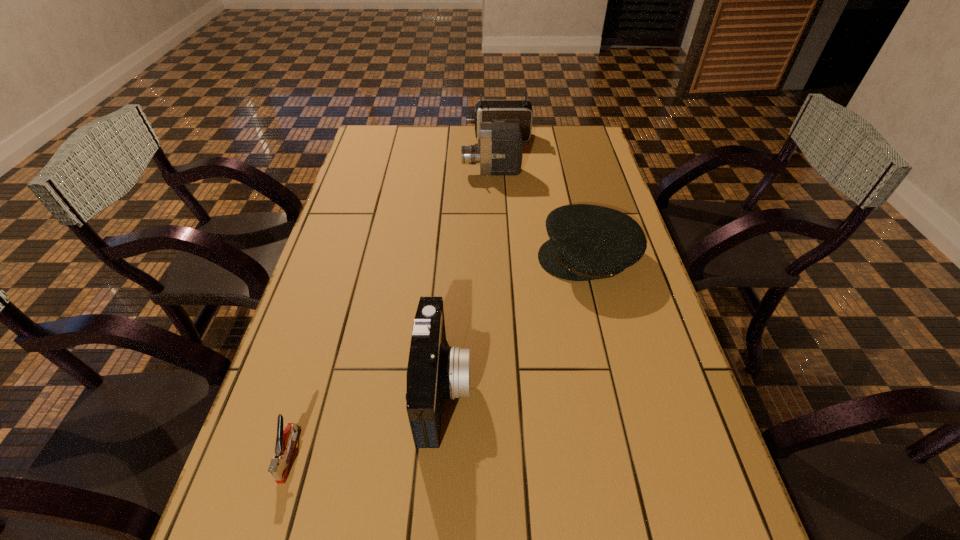
The width and height of the screenshot is (960, 540). In order to click on free space located 0.330m at the front of the second farthest camcorder, highlighting the lens in this screenshot , I will do `click(371, 172)`.

Where is `vacant space located at the front of the second farthest camcorder, highlighting the lens`? Image resolution: width=960 pixels, height=540 pixels. vacant space located at the front of the second farthest camcorder, highlighting the lens is located at coordinates (423, 172).

Where is `free point located 0.230m at the front of the second farthest camcorder, highlighting the lens`? free point located 0.230m at the front of the second farthest camcorder, highlighting the lens is located at coordinates (398, 172).

What are the coordinates of `vacant space located on the lens of the nearest camcorder` in the screenshot? It's located at (606, 388).

You are a GUI agent. You are given a task and a screenshot of the screen. Output one action in this format:
    pyautogui.click(x=<x>, y=<y>)
    Task: Click on the vacant region located on the front-facing side of the beret
    The image size is (960, 540).
    Given the screenshot: What is the action you would take?
    pyautogui.click(x=462, y=258)

Image resolution: width=960 pixels, height=540 pixels. Identify the location of vacant space located 0.100m on the front-facing side of the beret. (503, 258).

You are a GUI agent. You are given a task and a screenshot of the screen. Output one action in this format:
    pyautogui.click(x=<x>, y=<y>)
    Task: Click on the vacant space located 0.270m on the front-facing side of the beret
    The width and height of the screenshot is (960, 540).
    Given the screenshot: What is the action you would take?
    pyautogui.click(x=444, y=258)

Find the location of a particular element. The image size is (960, 540). vacant space located on the handle side of the stapler is located at coordinates coord(265,537).

This screenshot has width=960, height=540. What are the coordinates of `object at the far edge` in the screenshot? It's located at (513, 111).

This screenshot has width=960, height=540. Identify the location of object that is at the left edge. (285, 441).